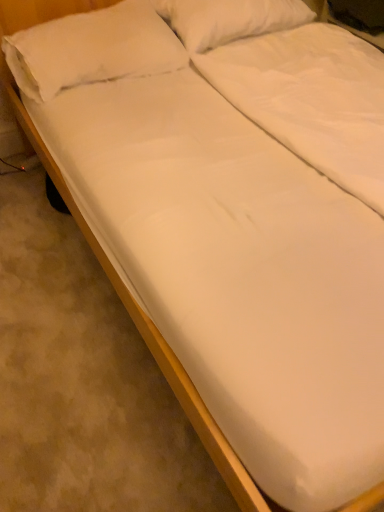
Image resolution: width=384 pixels, height=512 pixels. Describe the element at coordinates (229, 19) in the screenshot. I see `white soft pillow at upper center, which is the first pillow in right-to-left order` at that location.

Locate an element on the screen. white soft pillow at upper center, which is the first pillow in right-to-left order is located at coordinates (229, 19).

The width and height of the screenshot is (384, 512). What do you see at coordinates (92, 49) in the screenshot? I see `white soft pillow at upper left, arranged as the 1th pillow when viewed from the left` at bounding box center [92, 49].

Measure the distance between point (18,82) and camera.

Point (18,82) is 5.37 feet away from camera.

Based on the photo, measure the distance between white soft pillow at upper left, which is the second pillow from right to left, and camera.

A distance of 1.55 meters exists between white soft pillow at upper left, which is the second pillow from right to left, and camera.

Identify the location of white soft pillow at upper left, which is the second pillow from right to left. (92, 49).

In the scene shown: In order to face white soft pillow at upper left, arranged as the 1th pillow when viewed from the left, should I rotate leftwards or rightwards?

Rotate left and turn 13.000 degrees.

This screenshot has height=512, width=384. Find the location of `white soft pillow at upper center, which is the first pillow in right-to-left order`. white soft pillow at upper center, which is the first pillow in right-to-left order is located at coordinates (229, 19).

Which object is positioned more to the left, white soft pillow at upper left, which is the second pillow from right to left, or white soft pillow at upper center, which ranks as the 2th pillow in left-to-right order?

Positioned to the left is white soft pillow at upper left, which is the second pillow from right to left.

Which object is further away from the camera, white soft pillow at upper left, arranged as the 1th pillow when viewed from the left, or white soft pillow at upper center, which is the first pillow in right-to-left order?

white soft pillow at upper center, which is the first pillow in right-to-left order, is further away from the camera.

Is point (48, 78) closer to viewer compared to point (291, 21)?

Yes, point (48, 78) is in front of point (291, 21).

From the picture: From the image's perspective, is white soft pillow at upper left, which is the second pillow from right to left, beneath white soft pillow at upper center, which ranks as the 2th pillow in left-to-right order?

Yes, from the image's perspective, white soft pillow at upper left, which is the second pillow from right to left, is below white soft pillow at upper center, which ranks as the 2th pillow in left-to-right order.

From a real-world perspective, is white soft pillow at upper left, which is the second pillow from right to left, below white soft pillow at upper center, which is the first pillow in right-to-left order?

Indeed, from a real-world perspective, white soft pillow at upper left, which is the second pillow from right to left, is positioned beneath white soft pillow at upper center, which is the first pillow in right-to-left order.

Can you confirm if white soft pillow at upper left, arranged as the 1th pillow when viewed from the left, is thinner than white soft pillow at upper center, which ranks as the 2th pillow in left-to-right order?

No, white soft pillow at upper left, arranged as the 1th pillow when viewed from the left, is not thinner than white soft pillow at upper center, which ranks as the 2th pillow in left-to-right order.

In the scene shown: Does white soft pillow at upper left, which is the second pillow from right to left, have a greater height compared to white soft pillow at upper center, which is the first pillow in right-to-left order?

No.

Does white soft pillow at upper left, which is the second pillow from right to left, have a smaller size compared to white soft pillow at upper center, which ranks as the 2th pillow in left-to-right order?

Incorrect, white soft pillow at upper left, which is the second pillow from right to left, is not smaller in size than white soft pillow at upper center, which ranks as the 2th pillow in left-to-right order.

In the scene shown: Is white soft pillow at upper left, arranged as the 1th pillow when viewed from the left, situated inside white soft pillow at upper center, which ranks as the 2th pillow in left-to-right order, or outside?

white soft pillow at upper left, arranged as the 1th pillow when viewed from the left, is located beyond the bounds of white soft pillow at upper center, which ranks as the 2th pillow in left-to-right order.

Does white soft pillow at upper left, which is the second pillow from right to left, touch white soft pillow at upper center, which ranks as the 2th pillow in left-to-right order?

No, white soft pillow at upper left, which is the second pillow from right to left, is not touching white soft pillow at upper center, which ranks as the 2th pillow in left-to-right order.

Is white soft pillow at upper center, which ranks as the 2th pillow in left-to-right order, at the back of white soft pillow at upper left, arranged as the 1th pillow when viewed from the left?

white soft pillow at upper left, arranged as the 1th pillow when viewed from the left, is not turned away from white soft pillow at upper center, which ranks as the 2th pillow in left-to-right order.

How different are the orientations of white soft pillow at upper left, arranged as the 1th pillow when viewed from the left, and white soft pillow at upper center, which ranks as the 2th pillow in left-to-right order, in degrees?

The facing directions of white soft pillow at upper left, arranged as the 1th pillow when viewed from the left, and white soft pillow at upper center, which ranks as the 2th pillow in left-to-right order, are 0.466 degrees apart.

How distant is white soft pillow at upper left, which is the second pillow from right to left, from white soft pillow at upper center, which ranks as the 2th pillow in left-to-right order?

white soft pillow at upper left, which is the second pillow from right to left, is 30.34 centimeters from white soft pillow at upper center, which ranks as the 2th pillow in left-to-right order.

This screenshot has height=512, width=384. In the image, there is a white soft pillow at upper center, which ranks as the 2th pillow in left-to-right order. In order to click on pillow below it (from the image's perspective) in this screenshot , I will do `click(92, 49)`.

Between white soft pillow at upper center, which ranks as the 2th pillow in left-to-right order, and white soft pillow at upper left, which is the second pillow from right to left, which one appears on the left side from the viewer's perspective?

white soft pillow at upper left, which is the second pillow from right to left.

Is the position of white soft pillow at upper center, which is the first pillow in right-to-left order, more distant than that of white soft pillow at upper left, arranged as the 1th pillow when viewed from the left?

Yes, the depth of white soft pillow at upper center, which is the first pillow in right-to-left order, is greater than that of white soft pillow at upper left, arranged as the 1th pillow when viewed from the left.

Considering the positions of point (202, 15) and point (136, 39), is point (202, 15) closer or farther from the camera than point (136, 39)?

Point (202, 15) appears to be farther away from the viewer than point (136, 39).

From the image's perspective, who appears lower, white soft pillow at upper center, which is the first pillow in right-to-left order, or white soft pillow at upper left, which is the second pillow from right to left?

From the image's view, white soft pillow at upper left, which is the second pillow from right to left, is below.

Looking at this image, from a real-world perspective, is white soft pillow at upper center, which ranks as the 2th pillow in left-to-right order, beneath white soft pillow at upper left, arranged as the 1th pillow when viewed from the left?

No, from a real-world perspective, white soft pillow at upper center, which ranks as the 2th pillow in left-to-right order, is not beneath white soft pillow at upper left, arranged as the 1th pillow when viewed from the left.

Which object is thinner, white soft pillow at upper center, which is the first pillow in right-to-left order, or white soft pillow at upper left, arranged as the 1th pillow when viewed from the left?

With smaller width is white soft pillow at upper center, which is the first pillow in right-to-left order.

Considering the sizes of objects white soft pillow at upper center, which ranks as the 2th pillow in left-to-right order, and white soft pillow at upper left, which is the second pillow from right to left, in the image provided, who is taller, white soft pillow at upper center, which ranks as the 2th pillow in left-to-right order, or white soft pillow at upper left, which is the second pillow from right to left,?

Standing taller between the two is white soft pillow at upper center, which ranks as the 2th pillow in left-to-right order.

Considering the sizes of white soft pillow at upper center, which ranks as the 2th pillow in left-to-right order, and white soft pillow at upper left, which is the second pillow from right to left, in the image, is white soft pillow at upper center, which ranks as the 2th pillow in left-to-right order, bigger or smaller than white soft pillow at upper left, which is the second pillow from right to left,?

white soft pillow at upper center, which ranks as the 2th pillow in left-to-right order, is smaller than white soft pillow at upper left, which is the second pillow from right to left.

Is white soft pillow at upper center, which ranks as the 2th pillow in left-to-right order, outside of white soft pillow at upper left, which is the second pillow from right to left?

Indeed, white soft pillow at upper center, which ranks as the 2th pillow in left-to-right order, is completely outside white soft pillow at upper left, which is the second pillow from right to left.

Is there a large distance between white soft pillow at upper center, which ranks as the 2th pillow in left-to-right order, and white soft pillow at upper left, arranged as the 1th pillow when viewed from the left?

white soft pillow at upper center, which ranks as the 2th pillow in left-to-right order, is actually quite close to white soft pillow at upper left, arranged as the 1th pillow when viewed from the left.

Does white soft pillow at upper center, which is the first pillow in right-to-left order, turn towards white soft pillow at upper left, arranged as the 1th pillow when viewed from the left?

No, white soft pillow at upper center, which is the first pillow in right-to-left order, is not turned towards white soft pillow at upper left, arranged as the 1th pillow when viewed from the left.

Based on the photo, how many degrees apart are the facing directions of white soft pillow at upper center, which is the first pillow in right-to-left order, and white soft pillow at upper left, arranged as the 1th pillow when viewed from the left?

There is a 0.466-degree angle between the facing directions of white soft pillow at upper center, which is the first pillow in right-to-left order, and white soft pillow at upper left, arranged as the 1th pillow when viewed from the left.

Measure the distance from white soft pillow at upper center, which is the first pillow in right-to-left order, to white soft pillow at upper left, arranged as the 1th pillow when viewed from the left.

A distance of 11.95 inches exists between white soft pillow at upper center, which is the first pillow in right-to-left order, and white soft pillow at upper left, arranged as the 1th pillow when viewed from the left.

Find the location of a particular element. The image size is (384, 512). pillow above the white soft pillow at upper left, which is the second pillow from right to left (from the image's perspective) is located at coordinates (229, 19).

This screenshot has height=512, width=384. I want to click on pillow that appears on the right of white soft pillow at upper left, arranged as the 1th pillow when viewed from the left, so (x=229, y=19).

This screenshot has width=384, height=512. Identify the location of pillow above the white soft pillow at upper left, which is the second pillow from right to left (from the image's perspective). click(229, 19).